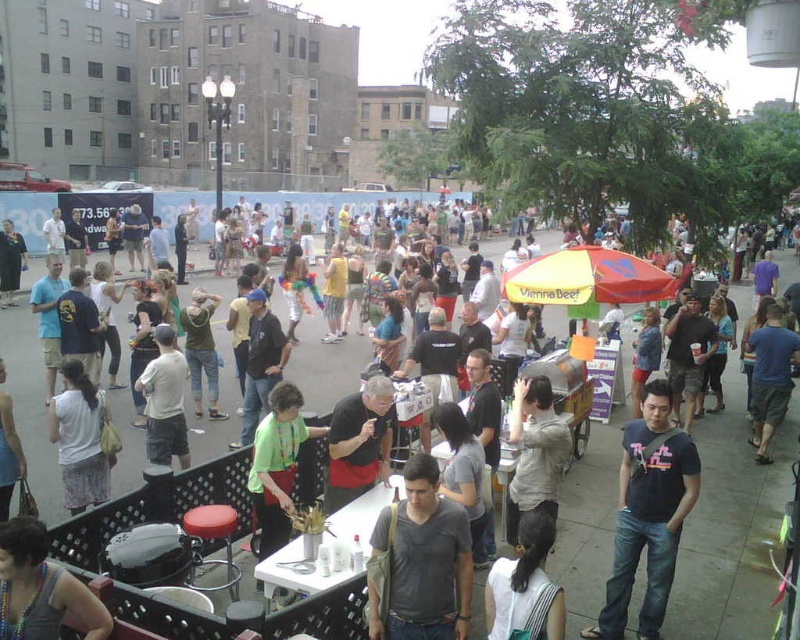
Question: Does dark blue t-shirt at center appear under dark gray cotton shirt at center?

Choices:
 (A) no
 (B) yes

Answer: (B)

Question: Which of the following is the farthest from the observer?

Choices:
 (A) dark gray cotton shirt at center
 (B) dark blue t-shirt at center

Answer: (B)

Question: Can you confirm if dark blue t-shirt at center is positioned to the left of dark gray cotton shirt at center?

Choices:
 (A) yes
 (B) no

Answer: (B)

Question: Is dark blue t-shirt at center positioned in front of dark gray cotton shirt at center?

Choices:
 (A) yes
 (B) no

Answer: (B)

Question: Which of the following is the closest to the observer?

Choices:
 (A) (470, 600)
 (B) (640, 486)

Answer: (A)